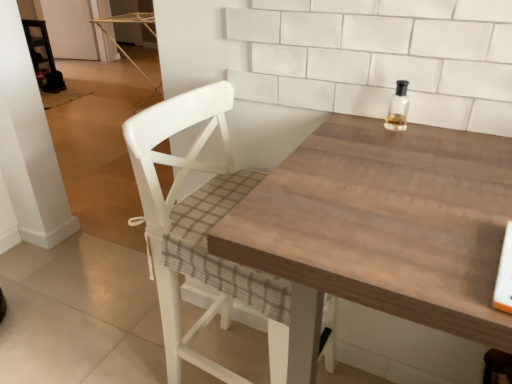
Find the location of a particular element. The height and width of the screenshot is (384, 512). white wood chair at center is located at coordinates (177, 206).

Identify the location of clear glass bottle at upper right. (398, 108).

Measure the distance between wooden table at center and camera.

A distance of 17.10 inches exists between wooden table at center and camera.

This screenshot has width=512, height=384. Identify the location of wooden table at center. (381, 229).

Locate an element on the screen. white wood chair at center is located at coordinates (177, 206).

Is clear glass bottle at upper right at the back of wooden table at center?

No, wooden table at center is not facing away from clear glass bottle at upper right.

Which of these two, wooden table at center or clear glass bottle at upper right, is smaller?

With smaller size is clear glass bottle at upper right.

From the image's perspective, is wooden table at center beneath clear glass bottle at upper right?

Correct, wooden table at center appears lower than clear glass bottle at upper right in the image.

Which object is more forward, wooden table at center or clear glass bottle at upper right?

wooden table at center is in front.

Can you tell me how much wooden table at center and white wood chair at center differ in facing direction?

They differ by 90 degrees in their facing directions.

Choose the correct answer: Is wooden table at center inside white wood chair at center or outside it?

wooden table at center is not inside white wood chair at center, it's outside.

Does wooden table at center appear on the left side of white wood chair at center?

No, wooden table at center is not to the left of white wood chair at center.

Does white wood chair at center have a lesser width compared to wooden table at center?

Indeed, white wood chair at center has a lesser width compared to wooden table at center.

Considering the positions of points (197, 116) and (312, 143), is point (197, 116) farther from camera compared to point (312, 143)?

Yes, it is.

Is white wood chair at center situated inside wooden table at center or outside?

white wood chair at center exists outside the volume of wooden table at center.

From a real-world perspective, is white wood chair at center under wooden table at center?

No, from a real-world perspective, white wood chair at center is not under wooden table at center.

Locate an element on the screen. table on the right of clear glass bottle at upper right is located at coordinates (381, 229).

Is point (390, 124) farther from camera compared to point (336, 171)?

Yes.

Is wooden table at center at the back of clear glass bottle at upper right?

No, wooden table at center is not at the back of clear glass bottle at upper right.

Can you tell me how much white wood chair at center and clear glass bottle at upper right differ in facing direction?

white wood chair at center and clear glass bottle at upper right are facing 94.1 degrees away from each other.

From the picture: Between white wood chair at center and clear glass bottle at upper right, which one is positioned behind?

Positioned behind is clear glass bottle at upper right.

Are white wood chair at center and clear glass bottle at upper right beside each other?

white wood chair at center and clear glass bottle at upper right are clearly separated.

Is white wood chair at center inside the boundaries of clear glass bottle at upper right, or outside?

white wood chair at center is outside clear glass bottle at upper right.

Do you think clear glass bottle at upper right is within white wood chair at center, or outside of it?

clear glass bottle at upper right cannot be found inside white wood chair at center.

Considering the sizes of clear glass bottle at upper right and white wood chair at center in the image, is clear glass bottle at upper right bigger or smaller than white wood chair at center?

Clearly, clear glass bottle at upper right is smaller in size than white wood chair at center.

Considering the relative positions of clear glass bottle at upper right and white wood chair at center in the image provided, is clear glass bottle at upper right to the right of white wood chair at center from the viewer's perspective?

Indeed, clear glass bottle at upper right is positioned on the right side of white wood chair at center.

From a real-world perspective, is clear glass bottle at upper right located beneath white wood chair at center?

No.

Locate an element on the screen. The image size is (512, 384). bottle above the wooden table at center (from a real-world perspective) is located at coordinates (398, 108).

This screenshot has height=384, width=512. In order to click on table in front of the white wood chair at center in this screenshot , I will do `click(381, 229)`.

When comparing their distances from clear glass bottle at upper right, does wooden table at center or white wood chair at center seem further?

white wood chair at center is further to clear glass bottle at upper right.

Looking at the image, which one is located closer to white wood chair at center, wooden table at center or clear glass bottle at upper right?

wooden table at center is closer to white wood chair at center.

From the image, which object appears to be farther from wooden table at center, white wood chair at center or clear glass bottle at upper right?

clear glass bottle at upper right lies further to wooden table at center than the other object.

Looking at the image, which one is located closer to wooden table at center, clear glass bottle at upper right or white wood chair at center?

white wood chair at center.

Estimate the real-world distances between objects in this image. Which object is closer to white wood chair at center, clear glass bottle at upper right or wooden table at center?

Among the two, wooden table at center is located nearer to white wood chair at center.

Based on their spatial positions, is white wood chair at center or wooden table at center further from clear glass bottle at upper right?

white wood chair at center lies further to clear glass bottle at upper right than the other object.

Identify the location of chair between clear glass bottle at upper right and wooden table at center vertically. The height and width of the screenshot is (384, 512). (177, 206).